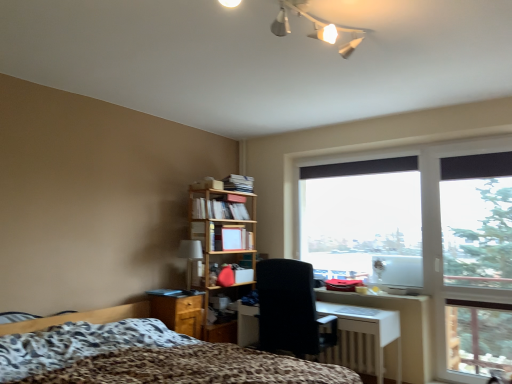
Question: Considering the positions of transparent glass window at center and white glossy desk at center in the image, is transparent glass window at center wider or thinner than white glossy desk at center?

Choices:
 (A) wide
 (B) thin

Answer: (B)

Question: Is transparent glass window at center taller or shorter than white glossy desk at center?

Choices:
 (A) tall
 (B) short

Answer: (A)

Question: Which of these objects is positioned farthest from the matte wooden bookshelf at center?

Choices:
 (A) leopard print fabric bed at lower left
 (B) transparent glass window at center
 (C) matte beige table lamp at center-left
 (D) wooden/file cabinet at lower left
 (E) black fabric chair at center

Answer: (A)

Question: Which object is the closest to the matte beige table lamp at center-left?

Choices:
 (A) leopard print fabric bed at lower left
 (B) white glossy desk at center
 (C) matte wooden bookshelf at center
 (D) wooden/file cabinet at lower left
 (E) transparent glass window at center

Answer: (D)